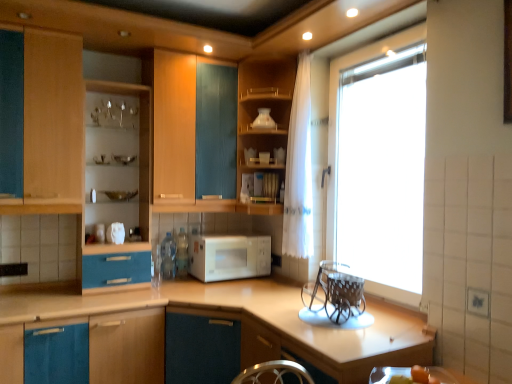
Where is `free spot above wooden cabinet at upper center, marked as the third cabinetry in a left-to-right arrangement (from a real-world perspective)`? free spot above wooden cabinet at upper center, marked as the third cabinetry in a left-to-right arrangement (from a real-world perspective) is located at coordinates (271, 57).